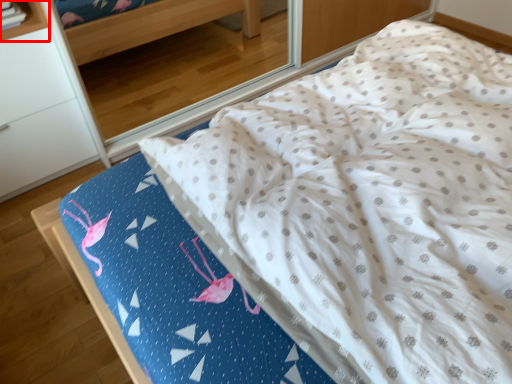
Question: From the image's perspective, what is the correct spatial positioning of shelf (annotated by the red box) in reference to furniture?

Choices:
 (A) above
 (B) below

Answer: (A)